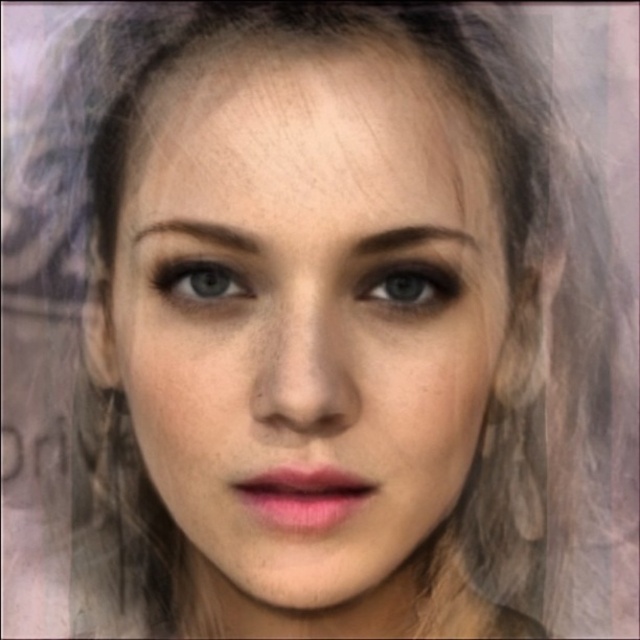
You are taking a photo of a person and want to focus on their eyes. You notice two points on their face at coordinates point (148, 236) and point (432, 236). Which point should you focus on to ensure the eyes are sharp?

You should focus on point (148, 236) because it is closer to the camera than point (432, 236), ensuring the eyes are in sharp focus.

You are a photographer adjusting the focus on your camera. You want to ensure the blue matte eye at center is in focus. Given that the focus point is set at point (406, 284), is the blue matte eye at center properly focused?

The blue matte eye at center is represented by point (406, 284), so yes, the focus point is set exactly at that coordinate, meaning the blue matte eye at center is properly focused.